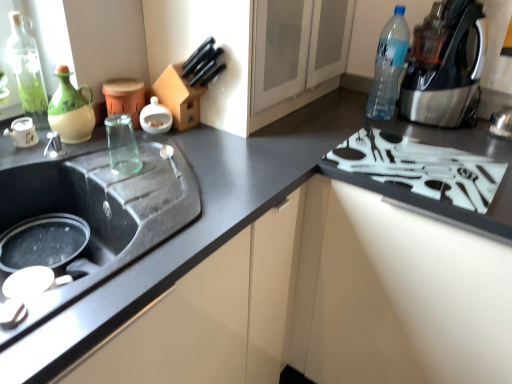
Identify the location of free space to the right of transparent glass cup at sink. (184, 176).